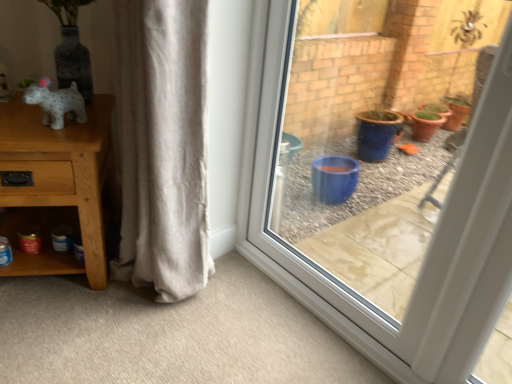
Identify the location of vacant space in front of speckled white dog at left. (34, 138).